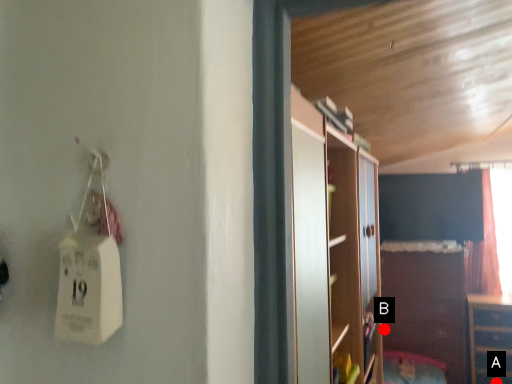
Question: Two points are circled on the image, labeled by A and B beside each circle. Among these points, which one is farthest from the camera?

Choices:
 (A) A is further
 (B) B is further

Answer: (B)